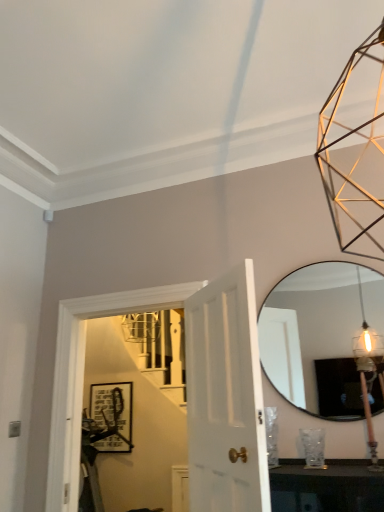
Question: From a real-world perspective, does matte glass mirror at right sit lower than black matte picture frame at center?

Choices:
 (A) no
 (B) yes

Answer: (A)

Question: Is matte glass mirror at right oriented away from black matte picture frame at center?

Choices:
 (A) no
 (B) yes

Answer: (A)

Question: Does matte glass mirror at right come in front of black matte picture frame at center?

Choices:
 (A) yes
 (B) no

Answer: (A)

Question: Could you tell me if matte glass mirror at right is facing black matte picture frame at center?

Choices:
 (A) yes
 (B) no

Answer: (B)

Question: Is matte glass mirror at right with black matte picture frame at center?

Choices:
 (A) yes
 (B) no

Answer: (B)

Question: Considering the relative positions of black matte picture frame at center and white glossy door at center in the image provided, is black matte picture frame at center to the left or to the right of white glossy door at center?

Choices:
 (A) right
 (B) left

Answer: (B)

Question: From a real-world perspective, is black matte picture frame at center positioned above or below white glossy door at center?

Choices:
 (A) below
 (B) above

Answer: (A)

Question: Considering the positions of black matte picture frame at center and white glossy door at center in the image, is black matte picture frame at center taller or shorter than white glossy door at center?

Choices:
 (A) tall
 (B) short

Answer: (B)

Question: Does point (127, 389) appear closer or farther from the camera than point (203, 352)?

Choices:
 (A) closer
 (B) farther

Answer: (B)

Question: Is wooden pole at right spatially inside matte glass mirror at right, or outside of it?

Choices:
 (A) inside
 (B) outside

Answer: (B)

Question: From their relative heights in the image, would you say wooden pole at right is taller or shorter than matte glass mirror at right?

Choices:
 (A) short
 (B) tall

Answer: (A)

Question: Looking at the image, does wooden pole at right seem bigger or smaller compared to matte glass mirror at right?

Choices:
 (A) big
 (B) small

Answer: (B)

Question: In the image, is wooden pole at right positioned in front of or behind matte glass mirror at right?

Choices:
 (A) behind
 (B) front

Answer: (B)

Question: From the image's perspective, is matte glass mirror at right positioned above or below white glossy door at center?

Choices:
 (A) below
 (B) above

Answer: (B)

Question: Is point pos(349,372) closer or farther from the camera than point pos(185,349)?

Choices:
 (A) farther
 (B) closer

Answer: (B)